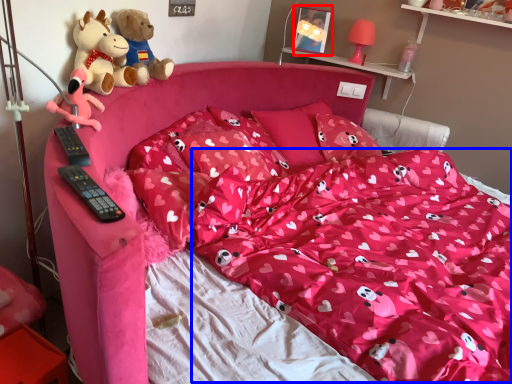
Question: Which point is closer to the camera, picture frame (highlighted by a red box) or blanket (highlighted by a blue box)?

Choices:
 (A) picture frame
 (B) blanket

Answer: (B)